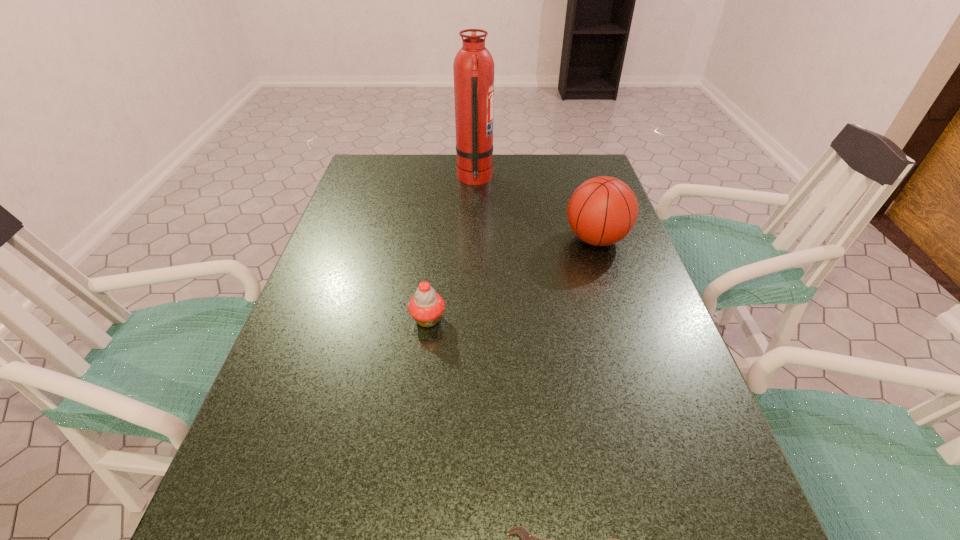
Where is `vacant point that satisfies the following two spatial constraints: 1. on the label side of the fire extinguisher; 2. on the back side of the basketball`? vacant point that satisfies the following two spatial constraints: 1. on the label side of the fire extinguisher; 2. on the back side of the basketball is located at coordinates (473, 239).